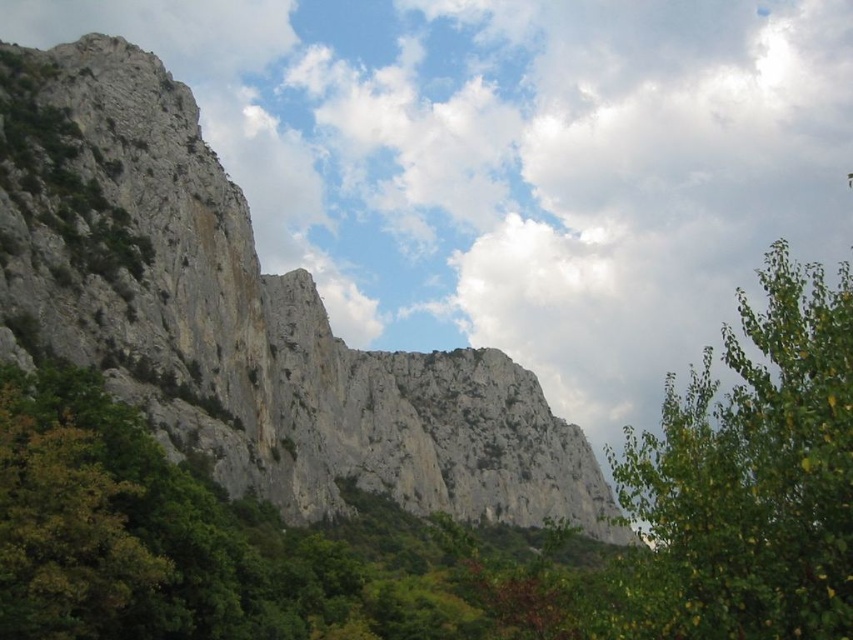
Question: Observing the image, what is the correct spatial positioning of gray rock at center in reference to green leafy tree at upper right?

Choices:
 (A) left
 (B) right

Answer: (A)

Question: Considering the relative positions of gray rock at center and green leafy tree at upper right in the image provided, where is gray rock at center located with respect to green leafy tree at upper right?

Choices:
 (A) below
 (B) above

Answer: (B)

Question: Is gray rock at center bigger than green leafy tree at upper right?

Choices:
 (A) yes
 (B) no

Answer: (B)